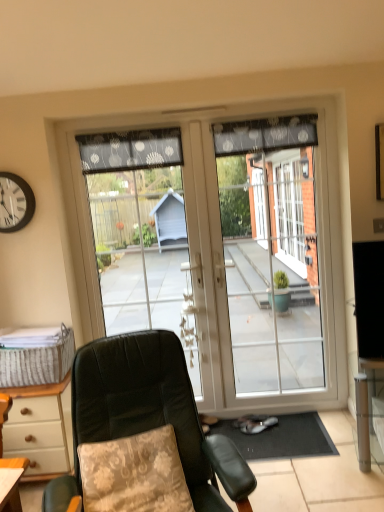
Question: From a real-world perspective, is dark gray dotted fabric at upper center, arranged as the second curtain when viewed from the right, physically above transparent glass door at center?

Choices:
 (A) yes
 (B) no

Answer: (A)

Question: Is transparent glass door at center a part of dark gray dotted fabric at upper center, arranged as the second curtain when viewed from the right?

Choices:
 (A) no
 (B) yes

Answer: (A)

Question: Is dark gray dotted fabric at upper center, arranged as the second curtain when viewed from the right, closer to the viewer compared to transparent glass door at center?

Choices:
 (A) yes
 (B) no

Answer: (A)

Question: Is dark gray dotted fabric at upper center, which ranks as the first curtain in left-to-right order, completely or partially outside of transparent glass door at center?

Choices:
 (A) no
 (B) yes

Answer: (A)

Question: Can you confirm if dark gray dotted fabric at upper center, which ranks as the first curtain in left-to-right order, is thinner than transparent glass door at center?

Choices:
 (A) yes
 (B) no

Answer: (B)

Question: Is black sheer curtain at upper center, which is the first curtain in right-to-left order, in front of or behind transparent glass door at center in the image?

Choices:
 (A) front
 (B) behind

Answer: (A)

Question: Considering the positions of black sheer curtain at upper center, which is the first curtain in right-to-left order, and transparent glass door at center in the image, is black sheer curtain at upper center, which is the first curtain in right-to-left order, wider or thinner than transparent glass door at center?

Choices:
 (A) thin
 (B) wide

Answer: (B)

Question: Considering the positions of black sheer curtain at upper center, which is the 2th curtain in left-to-right order, and transparent glass door at center in the image, is black sheer curtain at upper center, which is the 2th curtain in left-to-right order, taller or shorter than transparent glass door at center?

Choices:
 (A) tall
 (B) short

Answer: (B)

Question: From the image's perspective, is black sheer curtain at upper center, which is the first curtain in right-to-left order, above or below transparent glass door at center?

Choices:
 (A) below
 (B) above

Answer: (B)

Question: Do you think woven beige picnic basket at lower left is within transparent glass door at center, or outside of it?

Choices:
 (A) outside
 (B) inside

Answer: (A)

Question: Looking at the image, does woven beige picnic basket at lower left seem bigger or smaller compared to transparent glass door at center?

Choices:
 (A) big
 (B) small

Answer: (B)

Question: Does point (43, 371) appear closer or farther from the camera than point (322, 289)?

Choices:
 (A) farther
 (B) closer

Answer: (B)

Question: From a real-world perspective, relative to transparent glass door at center, is woven beige picnic basket at lower left vertically above or below?

Choices:
 (A) below
 (B) above

Answer: (A)

Question: Considering the positions of point (139, 457) and point (221, 479), is point (139, 457) closer or farther from the camera than point (221, 479)?

Choices:
 (A) closer
 (B) farther

Answer: (B)

Question: From the image's perspective, is floral fabric pillow at lower left above or below leather-like green chair at center?

Choices:
 (A) above
 (B) below

Answer: (B)